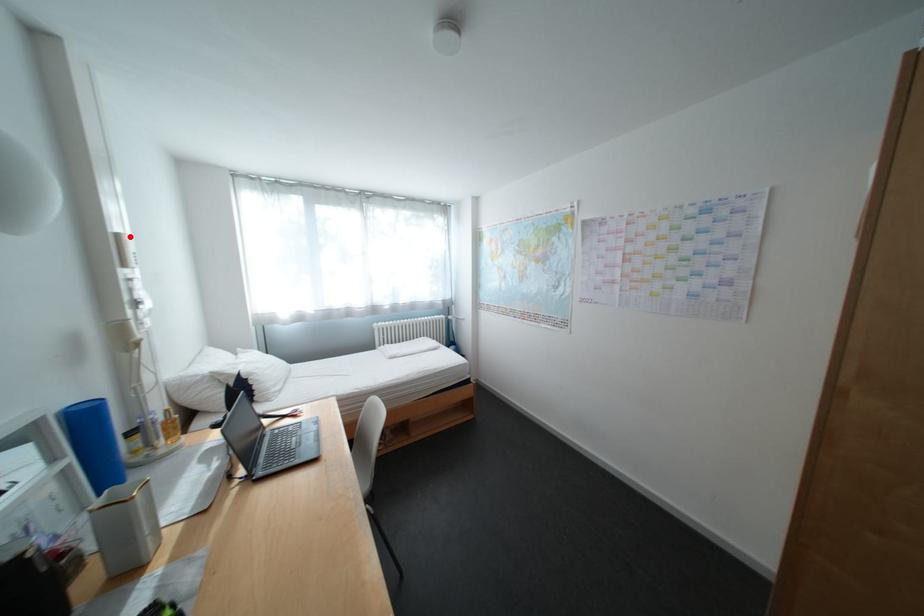
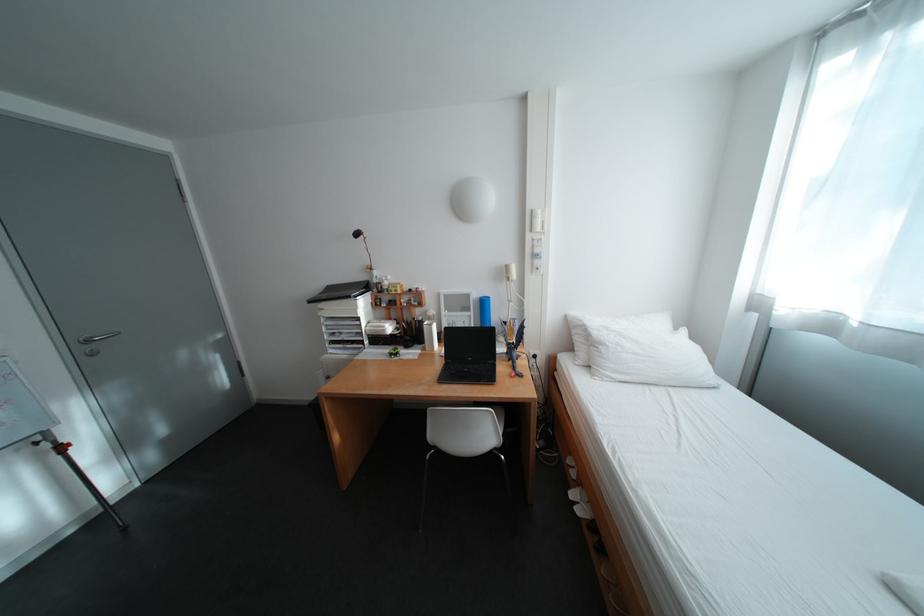
In the second image, find the point that corresponds to the highlighted location in the first image.

(544, 213)